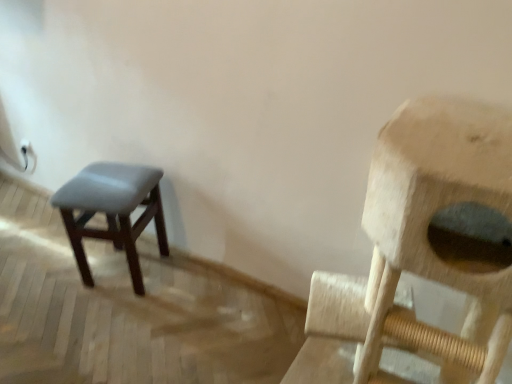
Where is `free spot to the right of matte gray stool at left`? Image resolution: width=512 pixels, height=384 pixels. free spot to the right of matte gray stool at left is located at coordinates (187, 286).